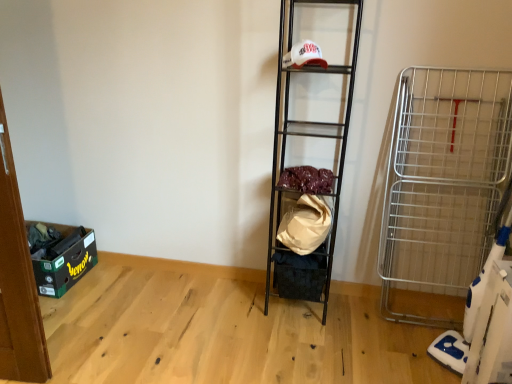
Question: From a real-world perspective, is green cardboard storage box at lower left, placed as the 1th storage box when sorted from left to right, physically above beige fabric bag at center, acting as the first material starting from the bottom?

Choices:
 (A) yes
 (B) no

Answer: (B)

Question: From a real-world perspective, is green cardboard storage box at lower left, placed as the 1th storage box when sorted from left to right, beneath beige fabric bag at center, acting as the first material starting from the bottom?

Choices:
 (A) no
 (B) yes

Answer: (B)

Question: Can you confirm if green cardboard storage box at lower left, placed as the 1th storage box when sorted from left to right, is bigger than beige fabric bag at center, acting as the first material starting from the bottom?

Choices:
 (A) yes
 (B) no

Answer: (A)

Question: Could you tell me if green cardboard storage box at lower left, placed as the 1th storage box when sorted from left to right, is facing beige fabric bag at center, acting as the first material starting from the bottom?

Choices:
 (A) yes
 (B) no

Answer: (A)

Question: Is green cardboard storage box at lower left, placed as the 1th storage box when sorted from left to right, outside of beige fabric bag at center, acting as the first material starting from the bottom?

Choices:
 (A) no
 (B) yes

Answer: (B)

Question: In terms of width, does beige fabric bag at center, which ranks as the 2th material in top-to-bottom order, look wider or thinner when compared to velvet-like fabric at center, acting as the first material starting from the top?

Choices:
 (A) wide
 (B) thin

Answer: (B)

Question: From a real-world perspective, is beige fabric bag at center, acting as the first material starting from the bottom, physically located above or below velvet-like fabric at center, acting as the first material starting from the top?

Choices:
 (A) below
 (B) above

Answer: (A)

Question: Looking at the image, does beige fabric bag at center, acting as the first material starting from the bottom, seem bigger or smaller compared to velvet-like fabric at center, which appears as the second material when ordered from the bottom?

Choices:
 (A) small
 (B) big

Answer: (B)

Question: From the image's perspective, is beige fabric bag at center, which ranks as the 2th material in top-to-bottom order, above or below velvet-like fabric at center, which appears as the second material when ordered from the bottom?

Choices:
 (A) below
 (B) above

Answer: (A)

Question: Is black fabric storage box at center, the second storage box in the left-to-right sequence, in front of or behind beige fabric bag at center, acting as the first material starting from the bottom, in the image?

Choices:
 (A) front
 (B) behind

Answer: (B)

Question: Looking at their shapes, would you say black fabric storage box at center, the 1th storage box when ordered from right to left, is wider or thinner than beige fabric bag at center, which ranks as the 2th material in top-to-bottom order?

Choices:
 (A) thin
 (B) wide

Answer: (B)

Question: Would you say black fabric storage box at center, the 1th storage box when ordered from right to left, is inside or outside beige fabric bag at center, which ranks as the 2th material in top-to-bottom order?

Choices:
 (A) outside
 (B) inside

Answer: (A)

Question: Considering the positions of point (275, 253) and point (288, 248), is point (275, 253) closer or farther from the camera than point (288, 248)?

Choices:
 (A) closer
 (B) farther

Answer: (B)

Question: Relative to silver metallic cart at right, is velvet-like fabric at center, acting as the first material starting from the top, in front or behind?

Choices:
 (A) behind
 (B) front

Answer: (A)

Question: Considering the relative positions of velvet-like fabric at center, which appears as the second material when ordered from the bottom, and silver metallic cart at right in the image provided, is velvet-like fabric at center, which appears as the second material when ordered from the bottom, to the left or to the right of silver metallic cart at right?

Choices:
 (A) right
 (B) left

Answer: (B)